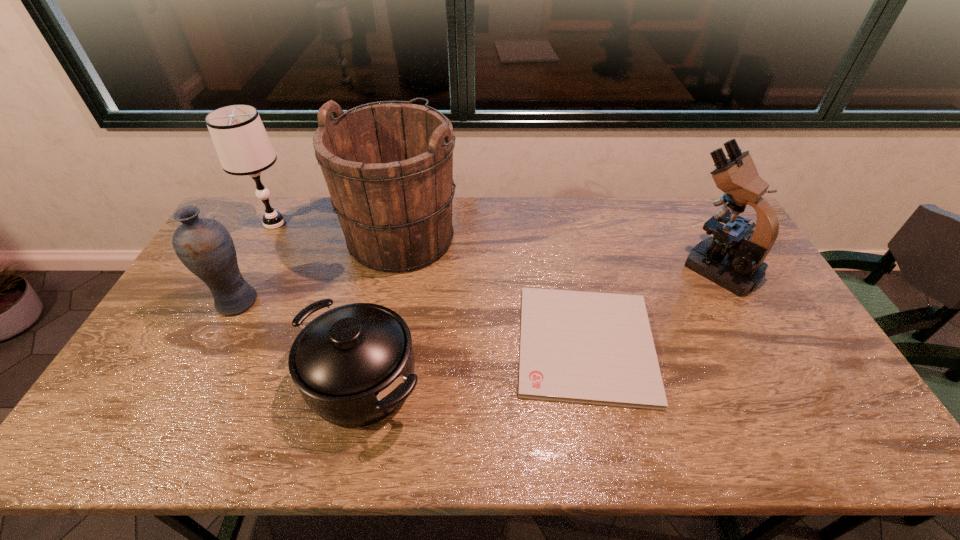
This screenshot has width=960, height=540. What are the coordinates of `free space between the shortest object and the bucket` in the screenshot? It's located at (493, 290).

This screenshot has width=960, height=540. What are the coordinates of `free space between the microscope and the bucket` in the screenshot? It's located at (560, 251).

At what (x,y) coordinates should I click in order to perform the action: click on free space between the bucket and the shortest object. Please return your answer as a coordinate pair (x, y). The height and width of the screenshot is (540, 960). Looking at the image, I should click on click(493, 290).

Locate an element on the screen. The width and height of the screenshot is (960, 540). vacant space that's between the table lamp and the shortest object is located at coordinates (430, 284).

Choose which object is the third nearest neighbor to the bucket. Please provide its 2D coordinates. Your answer should be formatted as a tuple, i.e. [(x, y)], where the tuple contains the x and y coordinates of a point satisfying the conditions above.

[(204, 245)]

Select which object is the third closest to the fifth object from left to right. Please provide its 2D coordinates. Your answer should be formatted as a tuple, i.e. [(x, y)], where the tuple contains the x and y coordinates of a point satisfying the conditions above.

[(354, 365)]

Locate an element on the screen. The height and width of the screenshot is (540, 960). vacant area that satisfies the following two spatial constraints: 1. on the back side of the second shortest object; 2. on the left side of the bucket is located at coordinates (394, 236).